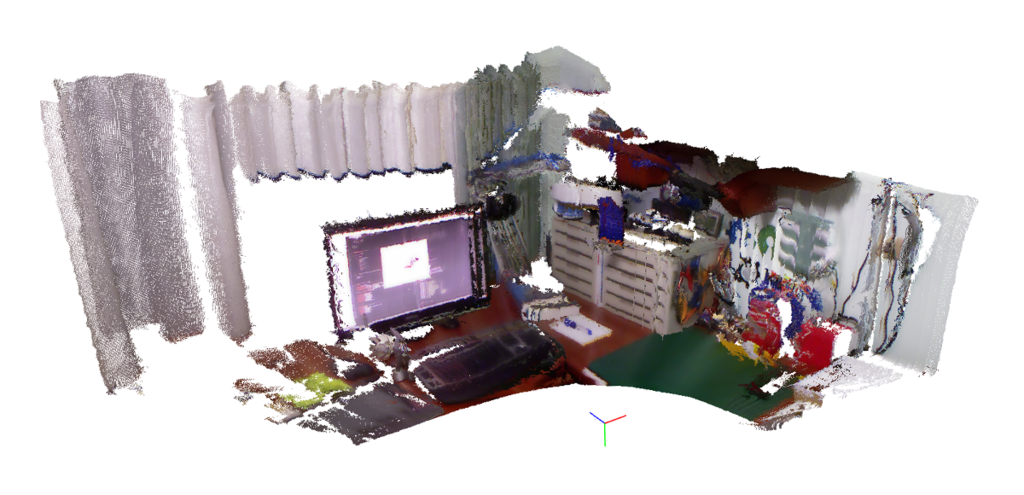
Where is `simulated keyboard`? This screenshot has width=1024, height=495. simulated keyboard is located at coordinates (488, 363).